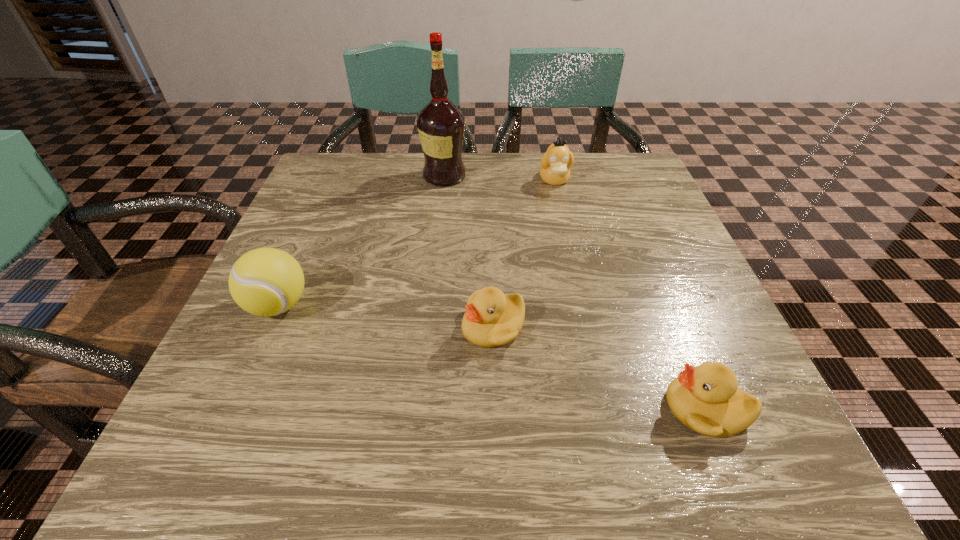
Locate an element on the screen. This screenshot has width=960, height=540. object that is the fourth closest to the rightmost duckling is located at coordinates (440, 124).

At what (x,y) coordinates should I click in order to perform the action: click on duckling that is the second nearest to the alcohol. Please return your answer as a coordinate pair (x, y). Looking at the image, I should click on (492, 319).

Select which duckling is the closest to the nearest duckling. Please provide its 2D coordinates. Your answer should be formatted as a tuple, i.e. [(x, y)], where the tuple contains the x and y coordinates of a point satisfying the conditions above.

[(492, 319)]

Identify the location of vacant space that satisfies the following two spatial constraints: 1. on the face of the tallest duckling; 2. on the beak of the second farthest duckling. (588, 327).

Find the location of a particular element. The image size is (960, 540). vacant region that satisfies the following two spatial constraints: 1. on the face of the fourth object from left to right; 2. on the beak of the second nearest duckling is located at coordinates (588, 327).